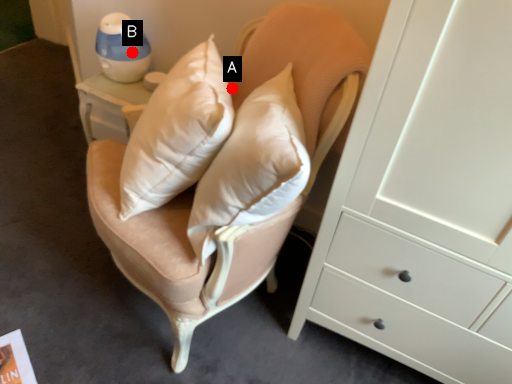
Question: Two points are circled on the image, labeled by A and B beside each circle. Among these points, which one is nearest to the camera?

Choices:
 (A) A is closer
 (B) B is closer

Answer: (A)